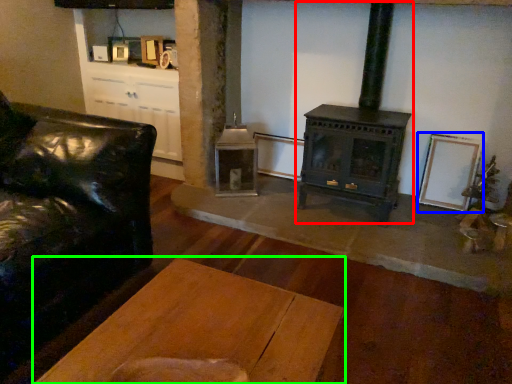
Question: Which is farther away from wood burning stove (highlighted by a red box)? picture frame (highlighted by a blue box) or table (highlighted by a green box)?

Choices:
 (A) picture frame
 (B) table

Answer: (B)